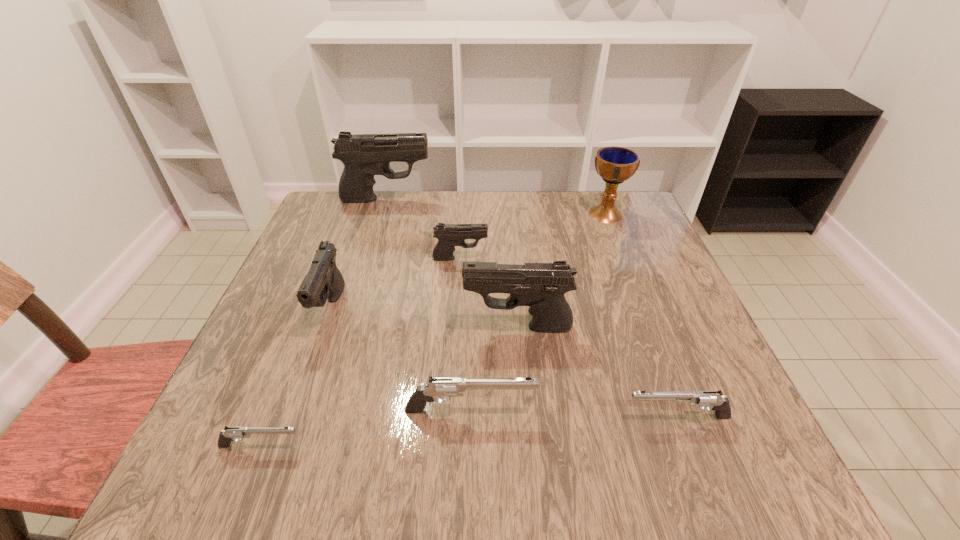
I want to click on free space between the second smallest black pistol and the second silver pistol from right to left, so click(x=400, y=360).

At what (x,y) coordinates should I click in order to perform the action: click on free space between the rightmost pistol and the fourth tallest object. Please return your answer as a coordinate pair (x, y). Looking at the image, I should click on (504, 363).

The height and width of the screenshot is (540, 960). Identify the location of vacant point located between the biggest black pistol and the second farthest black pistol. (423, 228).

At what (x,y) coordinates should I click in order to perform the action: click on vacant area that lies between the third tallest pistol and the blue chalice. Please return your answer as a coordinate pair (x, y). The image size is (960, 540). Looking at the image, I should click on (468, 261).

At what (x,y) coordinates should I click in order to perform the action: click on free space that is in between the farthest black pistol and the third smallest black pistol. Please return your answer as a coordinate pair (x, y). The height and width of the screenshot is (540, 960). Looking at the image, I should click on (452, 263).

The height and width of the screenshot is (540, 960). Find the location of `vacant region between the biggest silver pistol and the second smallest silver pistol`. vacant region between the biggest silver pistol and the second smallest silver pistol is located at coordinates (574, 414).

You are a GUI agent. You are given a task and a screenshot of the screen. Output one action in this format:
    pyautogui.click(x=<x>, y=<y>)
    Task: Click on the free space that is in between the tallest pistol and the biggest silver pistol
    Image resolution: width=960 pixels, height=540 pixels.
    Given the screenshot: What is the action you would take?
    (428, 305)

Find the location of a particular element. The height and width of the screenshot is (540, 960). vacant space in between the biggest silver pistol and the farthest pistol is located at coordinates (428, 305).

The width and height of the screenshot is (960, 540). Identify the location of object that can be found as the closest to the third smallest black pistol. click(x=439, y=387).

At what (x,y) coordinates should I click in order to perform the action: click on object that can be found as the seventh closest to the blue chalice. Please return your answer as a coordinate pair (x, y). This screenshot has width=960, height=540. Looking at the image, I should click on (230, 434).